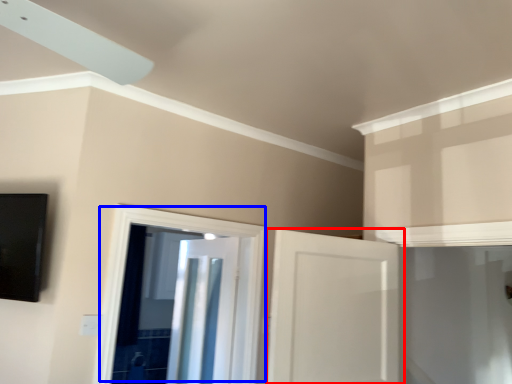
Question: Which object appears farthest to the camera in this image, door (highlighted by a red box) or door (highlighted by a blue box)?

Choices:
 (A) door
 (B) door

Answer: (B)